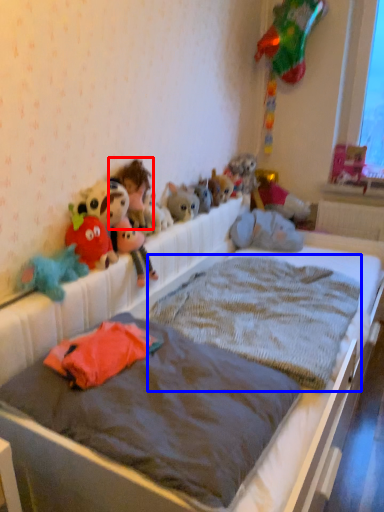
Question: Which of the following is the closest to the observer, toy (highlighted by a red box) or mattress (highlighted by a blue box)?

Choices:
 (A) toy
 (B) mattress

Answer: (B)